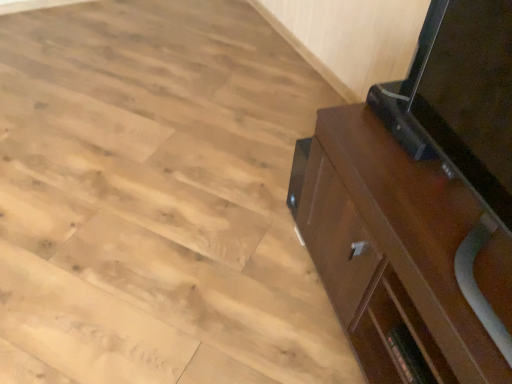
Question: Considering the positions of point (345, 130) and point (172, 130), is point (345, 130) closer or farther from the camera than point (172, 130)?

Choices:
 (A) farther
 (B) closer

Answer: (B)

Question: Considering the positions of dark brown wood cabinet at right and natural wood floor at lower right in the image, is dark brown wood cabinet at right taller or shorter than natural wood floor at lower right?

Choices:
 (A) short
 (B) tall

Answer: (B)

Question: Is dark brown wood cabinet at right wider or thinner than natural wood floor at lower right?

Choices:
 (A) thin
 (B) wide

Answer: (A)

Question: Would you say natural wood floor at lower right is inside or outside dark brown wood cabinet at right?

Choices:
 (A) inside
 (B) outside

Answer: (B)

Question: From a real-world perspective, is natural wood floor at lower right physically located above or below dark brown wood cabinet at right?

Choices:
 (A) above
 (B) below

Answer: (B)

Question: Looking at the image, does natural wood floor at lower right seem bigger or smaller compared to dark brown wood cabinet at right?

Choices:
 (A) small
 (B) big

Answer: (B)

Question: Is point (126, 296) closer or farther from the camera than point (366, 134)?

Choices:
 (A) farther
 (B) closer

Answer: (A)